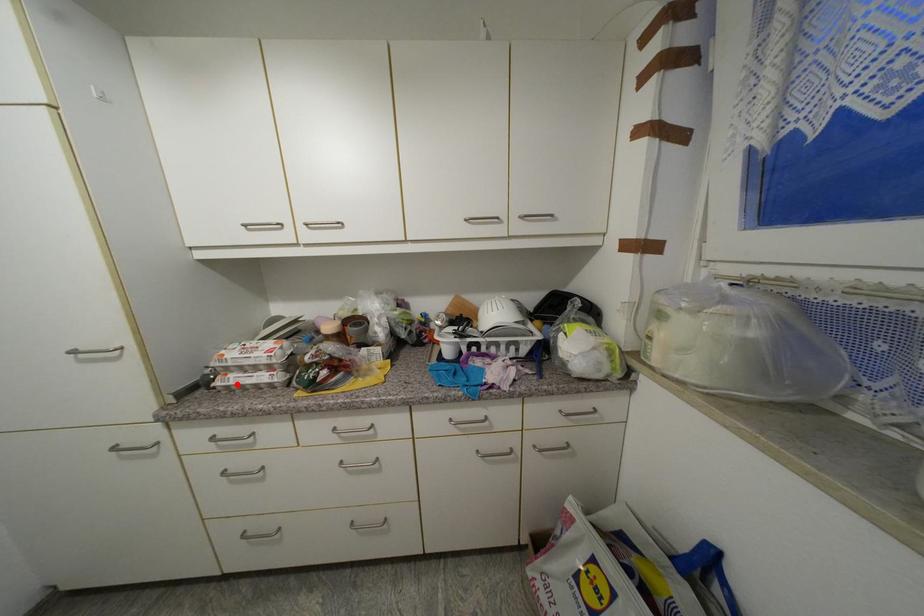
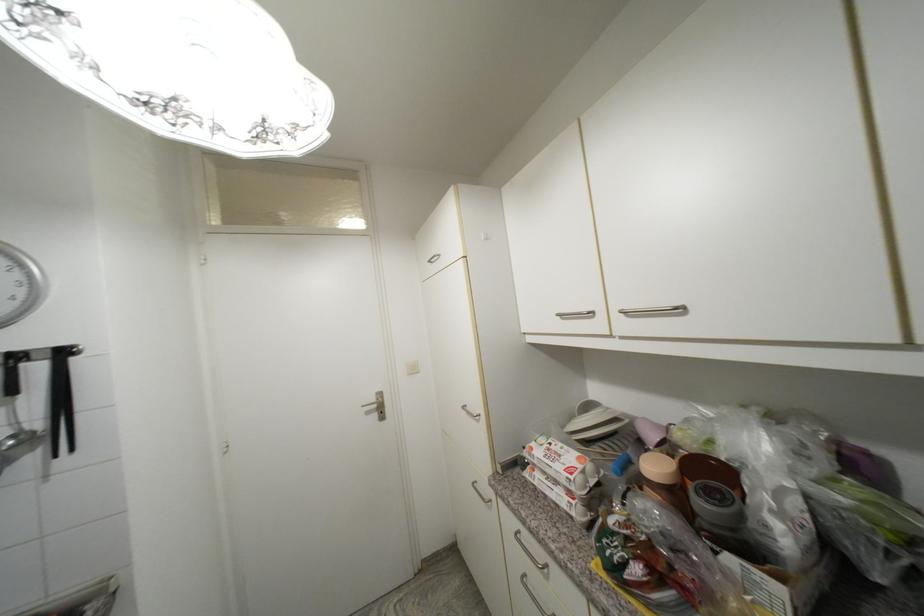
The point at the highlighted location is marked in the first image. Where is the corresponding point in the second image?

(541, 485)